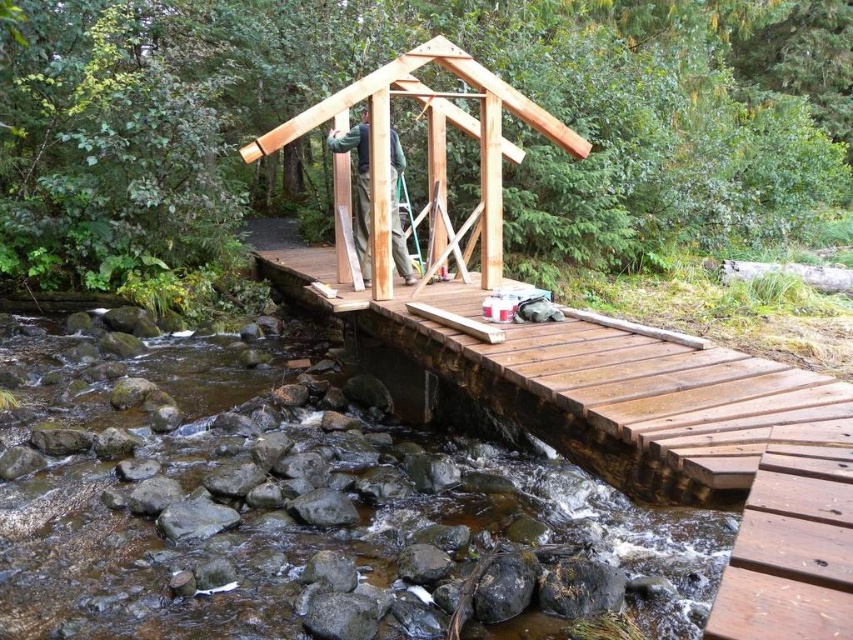
Question: Which of the following is the closest to the observer?

Choices:
 (A) natural wood cabin at center
 (B) brown smooth rocks at lower left
 (C) natural wood bridge at center

Answer: (B)

Question: Which of the following is the farthest from the observer?

Choices:
 (A) natural wood bridge at center
 (B) brown smooth rocks at lower left

Answer: (A)

Question: From the image, what is the correct spatial relationship of brown smooth rocks at lower left in relation to natural wood bridge at center?

Choices:
 (A) above
 (B) below

Answer: (B)

Question: Which of the following is the farthest from the observer?

Choices:
 (A) natural wood bridge at center
 (B) natural wood cabin at center

Answer: (B)

Question: Does brown smooth rocks at lower left lie in front of natural wood bridge at center?

Choices:
 (A) no
 (B) yes

Answer: (B)

Question: Can you confirm if brown smooth rocks at lower left is positioned to the right of natural wood cabin at center?

Choices:
 (A) no
 (B) yes

Answer: (A)